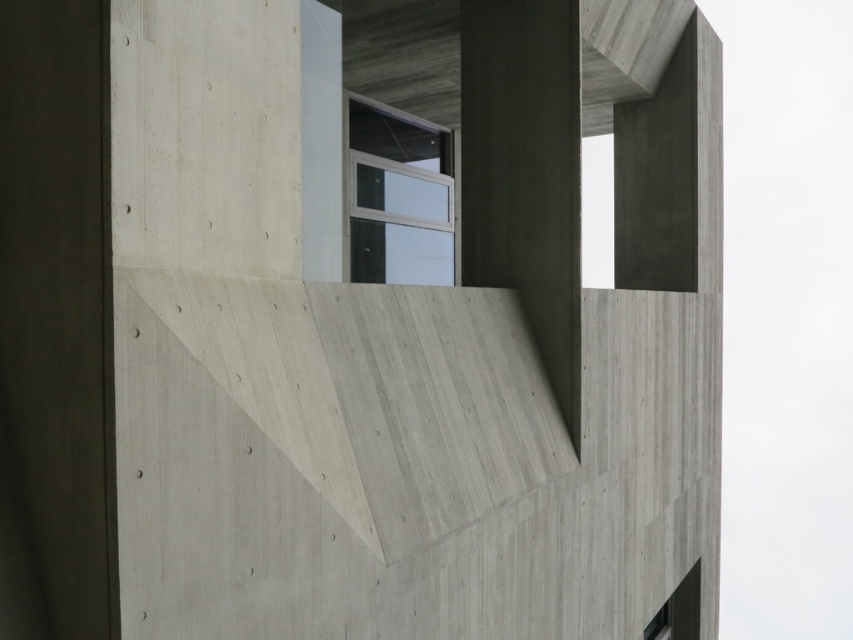
Question: Is gray concrete at center to the left of clear glass window at center from the viewer's perspective?

Choices:
 (A) no
 (B) yes

Answer: (A)

Question: Considering the relative positions of gray concrete at center and matte glass window at lower right in the image provided, where is gray concrete at center located with respect to matte glass window at lower right?

Choices:
 (A) left
 (B) right

Answer: (A)

Question: Which point appears closest to the camera in this image?

Choices:
 (A) (672, 609)
 (B) (372, 168)

Answer: (B)

Question: Considering the real-world distances, which object is farthest from the matte glass window at lower right?

Choices:
 (A) clear glass window at center
 (B) gray concrete at center

Answer: (A)

Question: Is clear glass window at center above matte glass window at lower right?

Choices:
 (A) no
 (B) yes

Answer: (B)

Question: Which point appears closest to the camera in this image?

Choices:
 (A) (683, 595)
 (B) (413, 316)

Answer: (B)